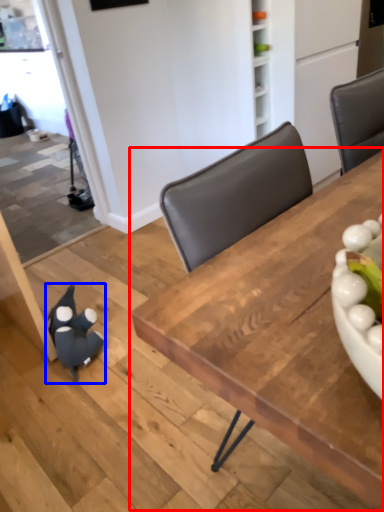
Question: Among these objects, which one is nearest to the camera, table (highlighted by a red box) or toy (highlighted by a blue box)?

Choices:
 (A) table
 (B) toy

Answer: (A)